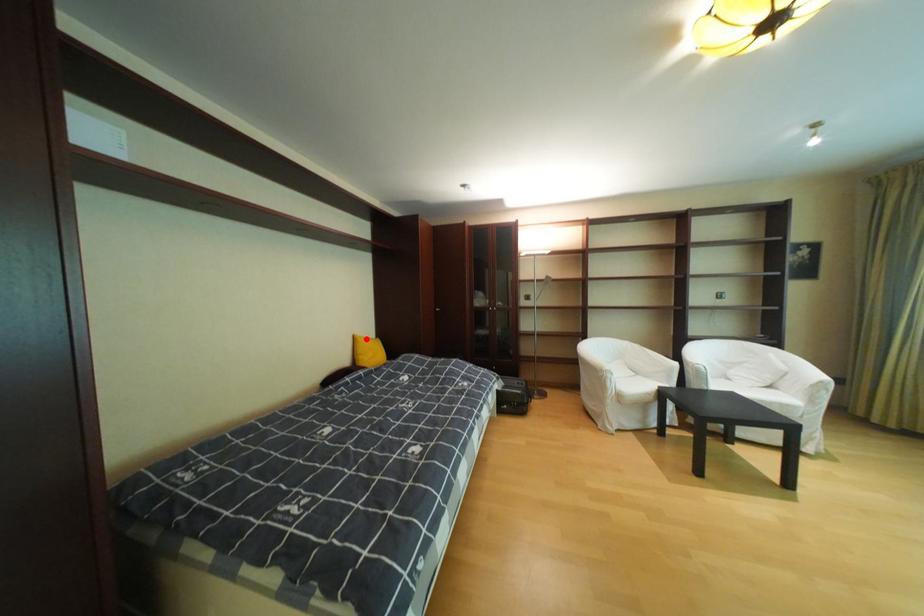
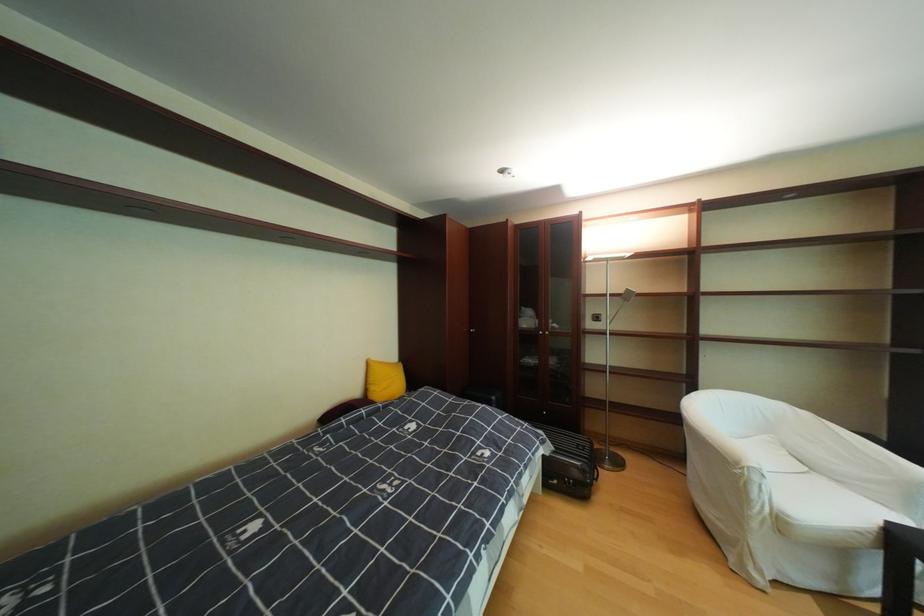
In the second image, find the point that corresponds to the highlighted location in the first image.

(380, 363)